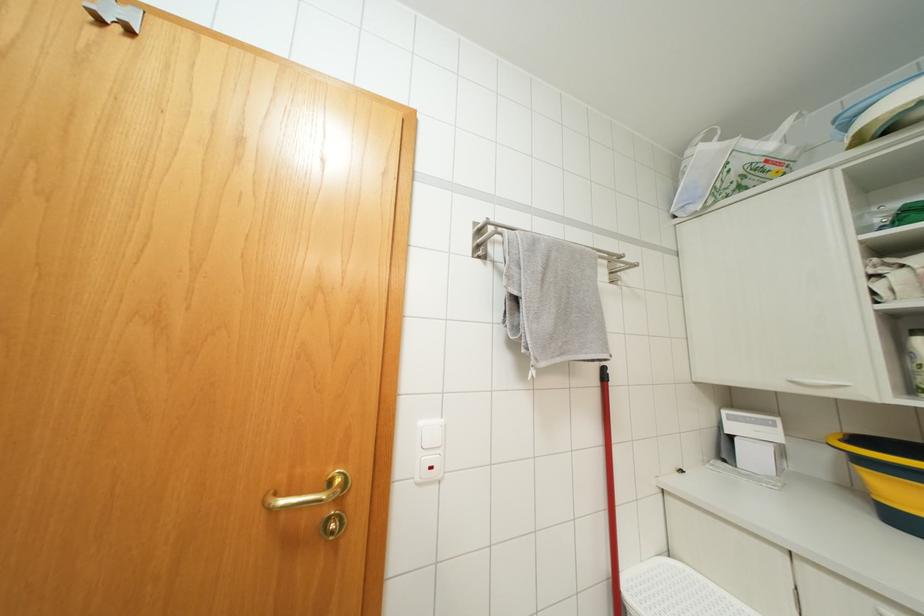
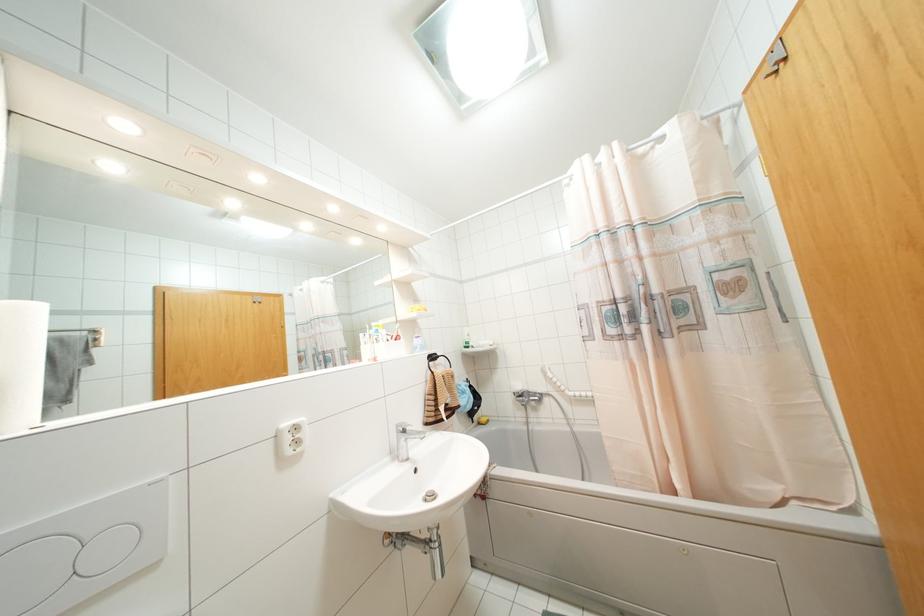
The point at (128, 31) is marked in the first image. Where is the corresponding point in the second image?

(784, 58)